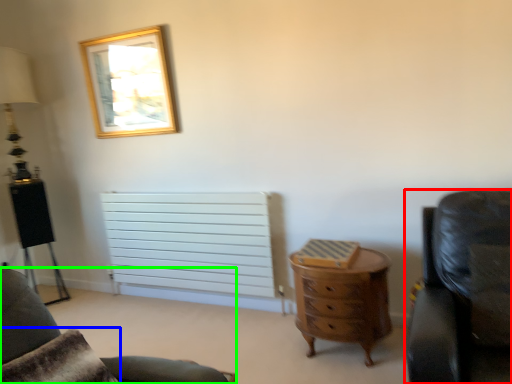
Question: Considering the real-world distances, which object is closest to chair (highlighted by a red box)? pillow (highlighted by a blue box) or chair (highlighted by a green box).

Choices:
 (A) pillow
 (B) chair

Answer: (B)